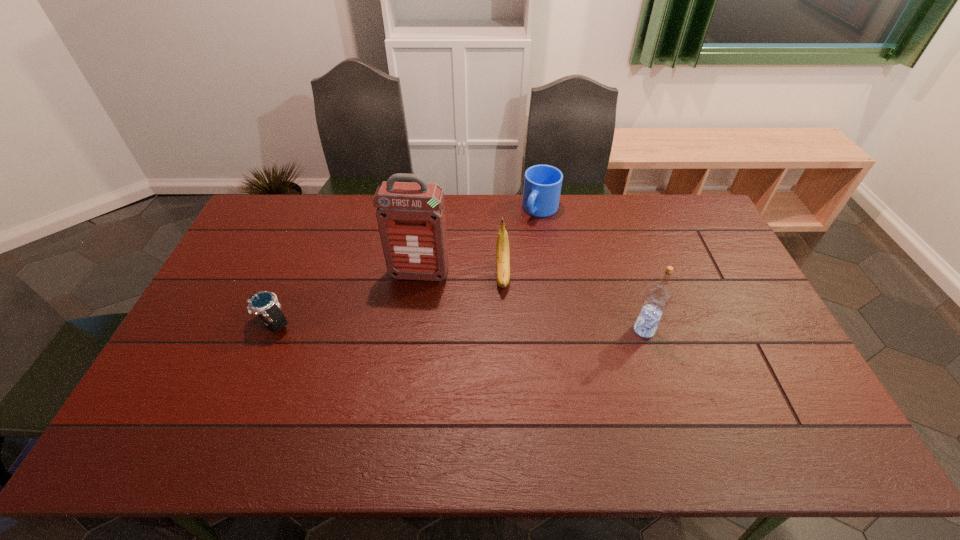
Find the location of `vacant region located 0.320m on the back of the watch`. vacant region located 0.320m on the back of the watch is located at coordinates (308, 240).

You are a GUI agent. You are given a task and a screenshot of the screen. Output one action in this format:
    pyautogui.click(x=<x>, y=<y>)
    Task: Click on the free space located on the back of the second tallest object
    The image size is (960, 540).
    Given the screenshot: What is the action you would take?
    pyautogui.click(x=631, y=288)

This screenshot has width=960, height=540. What are the coordinates of `vacant space situated 0.150m on the side of the second object from right to left with the handle` in the screenshot? It's located at (517, 247).

Locate an element on the screen. The width and height of the screenshot is (960, 540). free space located 0.070m on the side of the second object from right to left with the handle is located at coordinates (527, 234).

Locate an element on the screen. The height and width of the screenshot is (540, 960). free space located 0.070m on the side of the second object from right to left with the handle is located at coordinates (527, 234).

In order to click on vacant space located 0.360m at the start of the peel on the third tallest object in this screenshot , I will do `click(509, 403)`.

The image size is (960, 540). I want to click on vacant area located at the start of the peel on the third tallest object, so click(x=508, y=382).

Locate an element on the screen. free space located 0.370m at the start of the peel on the third tallest object is located at coordinates (509, 407).

Find the location of a particular element. This screenshot has height=540, width=960. free space located on the front-facing side of the second object from left to right is located at coordinates (400, 346).

The height and width of the screenshot is (540, 960). I want to click on vacant point located 0.120m on the front-facing side of the second object from left to right, so click(408, 312).